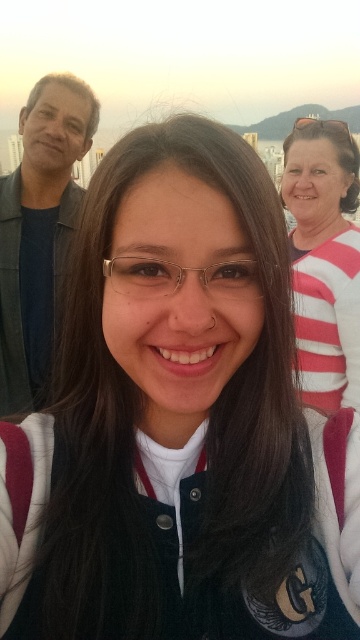
Between matte black jacket at left and clear plastic glasses at upper center, which one is positioned higher?

clear plastic glasses at upper center is above.

This screenshot has width=360, height=640. What do you see at coordinates (38, 228) in the screenshot?
I see `matte black jacket at left` at bounding box center [38, 228].

Is point (47, 212) less distant than point (336, 124)?

Yes, point (47, 212) is in front of point (336, 124).

You are a GUI agent. You are given a task and a screenshot of the screen. Output one action in this format:
    pyautogui.click(x=<x>, y=<y>)
    Task: Click on the matte black jacket at left
    Image resolution: width=360 pixels, height=640 pixels.
    Given the screenshot: What is the action you would take?
    pyautogui.click(x=38, y=228)

Who is positioned more to the right, white striped sweater at upper right or clear plastic glasses at center?

white striped sweater at upper right is more to the right.

Is white striped sweater at upper right to the right of clear plastic glasses at center from the viewer's perspective?

Yes, white striped sweater at upper right is to the right of clear plastic glasses at center.

What do you see at coordinates (325, 260) in the screenshot? The image size is (360, 640). I see `white striped sweater at upper right` at bounding box center [325, 260].

The width and height of the screenshot is (360, 640). In order to click on white striped sweater at upper right in this screenshot , I will do `click(325, 260)`.

Is matte black jacket at left bigger than white striped sweater at upper right?

Yes, matte black jacket at left is bigger than white striped sweater at upper right.

Does point (73, 220) lie behind point (331, 241)?

No, it is in front of (331, 241).

Who is more forward, (12, 381) or (348, 227)?

Positioned in front is point (12, 381).

Locate an element on the screen. matte black jacket at left is located at coordinates (38, 228).